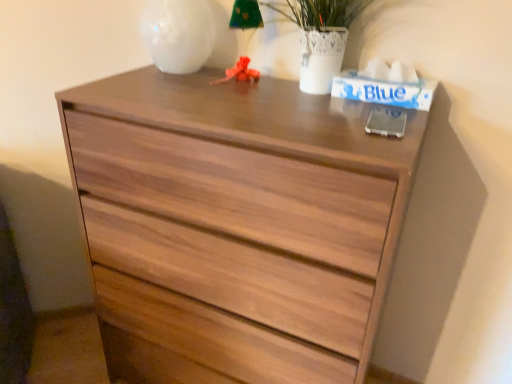
Question: Would you say matte white glass at upper center is to the left or to the right of wooden chest of drawers at center in the picture?

Choices:
 (A) left
 (B) right

Answer: (A)

Question: From the image's perspective, is matte white glass at upper center above or below wooden chest of drawers at center?

Choices:
 (A) below
 (B) above

Answer: (B)

Question: Does point (247, 77) appear closer or farther from the camera than point (142, 231)?

Choices:
 (A) farther
 (B) closer

Answer: (A)

Question: Considering the relative positions of wooden chest of drawers at center and matte white glass at upper center in the image provided, is wooden chest of drawers at center to the left or to the right of matte white glass at upper center?

Choices:
 (A) left
 (B) right

Answer: (B)

Question: Do you think wooden chest of drawers at center is within matte white glass at upper center, or outside of it?

Choices:
 (A) inside
 (B) outside

Answer: (B)

Question: Is point [352, 291] closer or farther from the camera than point [251, 0]?

Choices:
 (A) closer
 (B) farther

Answer: (A)

Question: From a real-world perspective, relative to matte white glass at upper center, is wooden chest of drawers at center vertically above or below?

Choices:
 (A) below
 (B) above

Answer: (A)